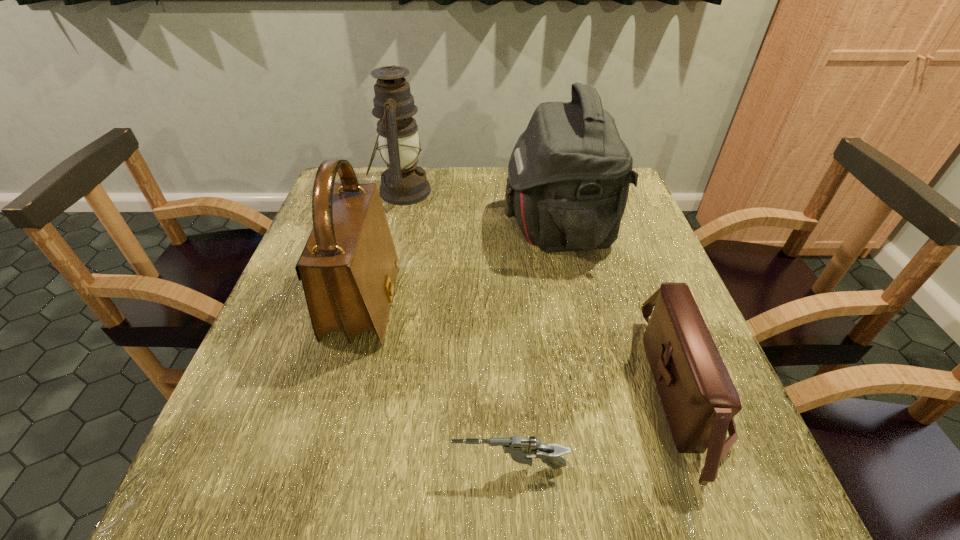
Where is `oil lamp`? The width and height of the screenshot is (960, 540). oil lamp is located at coordinates (404, 183).

Find the location of a particular element. the leftmost shoulder bag is located at coordinates (348, 268).

In order to click on the shortest shoulder bag in this screenshot , I will do `click(699, 398)`.

Where is `gun`? This screenshot has height=540, width=960. gun is located at coordinates (520, 450).

In order to click on free space located on the front of the oil lamp in this screenshot , I will do `click(381, 282)`.

Where is `vacant point located on the front flap of the leftmost shoulder bag`? This screenshot has height=540, width=960. vacant point located on the front flap of the leftmost shoulder bag is located at coordinates (565, 304).

Where is `vacant space located on the front flap of the shortest shoulder bag`? The height and width of the screenshot is (540, 960). vacant space located on the front flap of the shortest shoulder bag is located at coordinates (544, 393).

Find the location of a particular element. This screenshot has height=540, width=960. free region located on the front flap of the shortest shoulder bag is located at coordinates (434, 393).

Locate an element on the screen. Image resolution: width=960 pixels, height=540 pixels. vacant region located 0.190m on the front flap of the shortest shoulder bag is located at coordinates (544, 393).

Find the location of `free region located at the barrel of the gun`. free region located at the barrel of the gun is located at coordinates (421, 468).